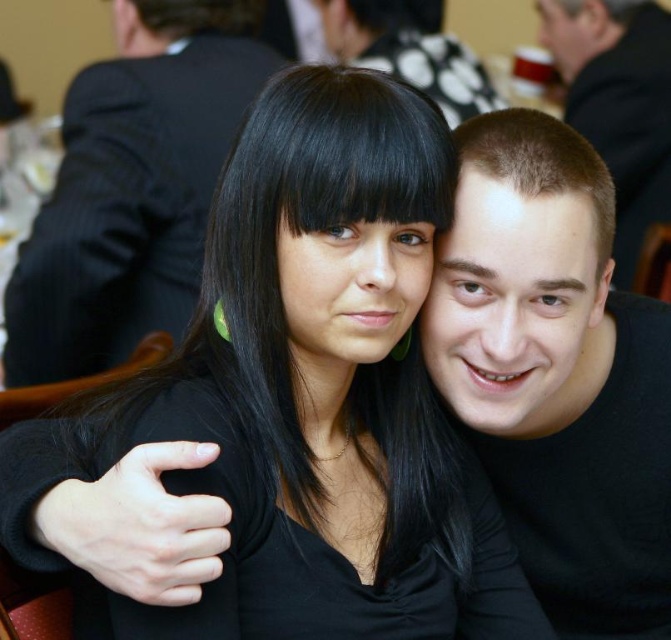
Question: Which of these objects is positioned closest to the smooth black shirt at center?

Choices:
 (A) black matte shirt at center
 (B) black matte suit at upper left

Answer: (B)

Question: Which point appears farthest from the camera in this image?

Choices:
 (A) (142, 28)
 (B) (541, 529)

Answer: (A)

Question: Is black matte shirt at center below black matte suit at upper left?

Choices:
 (A) no
 (B) yes

Answer: (B)

Question: Can you confirm if black matte shirt at center is smaller than smooth black shirt at center?

Choices:
 (A) yes
 (B) no

Answer: (A)

Question: Which of the following is the closest to the observer?

Choices:
 (A) black matte shirt at center
 (B) black matte suit at upper left
 (C) smooth black shirt at center

Answer: (A)

Question: Is black matte shirt at center in front of black matte suit at upper left?

Choices:
 (A) no
 (B) yes

Answer: (B)